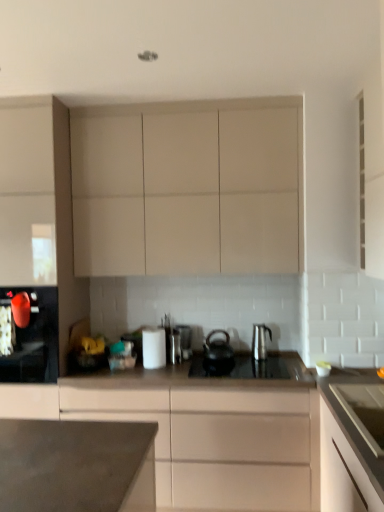
The image size is (384, 512). I want to click on vacant point to the right of satin silver kettle at center, marked as the 1th kitchen appliance in a right-to-left arrangement, so click(x=288, y=361).